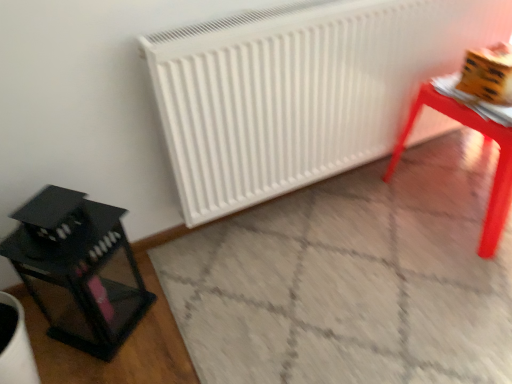
Locate an element on the screen. The width and height of the screenshot is (512, 384). free point below white matte radiator at center (from a real-world perspective) is located at coordinates (342, 185).